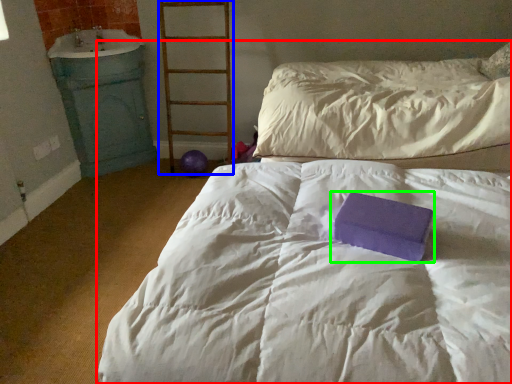
Question: Considering the real-world distances, which object is closest to bed (highlighted by a red box)? ladder (highlighted by a blue box) or paperback book (highlighted by a green box).

Choices:
 (A) ladder
 (B) paperback book

Answer: (B)